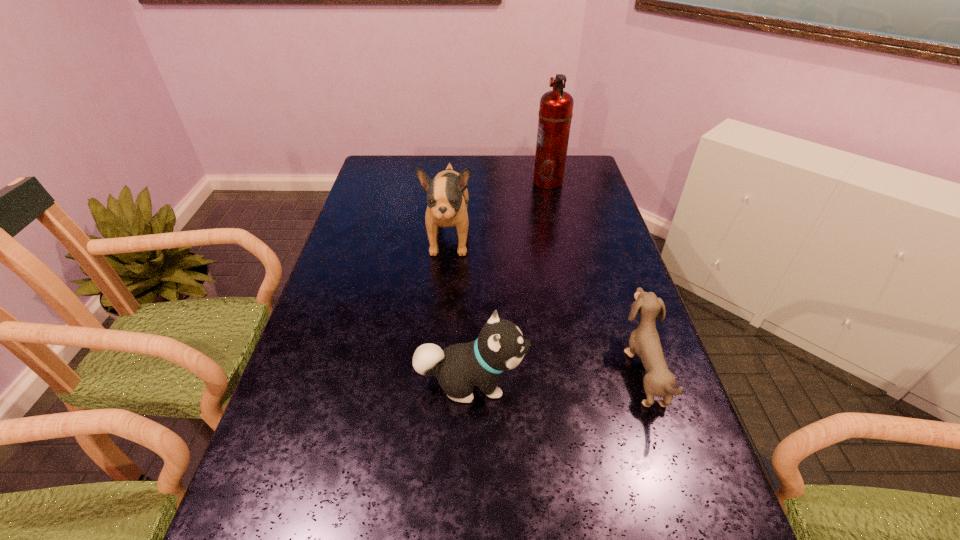
The width and height of the screenshot is (960, 540). I want to click on the second object from right to left, so click(555, 114).

Locate an element on the screen. the tallest object is located at coordinates (555, 114).

Locate an element on the screen. the third nearest object is located at coordinates (447, 196).

The height and width of the screenshot is (540, 960). Find the location of `the tallest puppy`. the tallest puppy is located at coordinates (447, 196).

Identify the location of the second tallest puppy. The height and width of the screenshot is (540, 960). (500, 346).

Identify the location of the shortest puppy. This screenshot has width=960, height=540. (644, 341).

The image size is (960, 540). I want to click on the shortest object, so click(x=644, y=341).

I want to click on free point located on the nozzle side of the fire extinguisher, so click(x=453, y=182).

The width and height of the screenshot is (960, 540). In order to click on vacant space located on the nozzle side of the fire extinguisher in this screenshot , I will do `click(495, 182)`.

Where is `vacant space located 0.230m on the nozzle side of the fire extinguisher`? The height and width of the screenshot is (540, 960). vacant space located 0.230m on the nozzle side of the fire extinguisher is located at coordinates (471, 182).